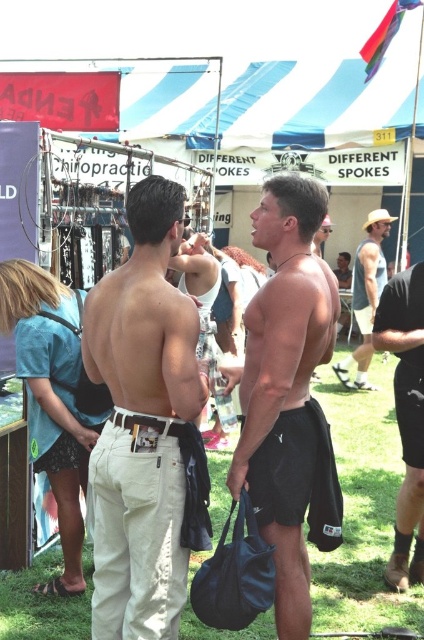
You are standing at the back of the scene and want to approach the two men. Which of the two men, the one wearing tan cotton pants at center or the one wearing black matte shorts at center, will you reach first?

The tan cotton pants at center is closer to the viewer than the black matte shorts at center, so you will reach the man wearing tan cotton pants at center first.

You are a fashion designer analyzing clothing items in the scene. Which clothing item, the tan cotton pants at center or the denim shorts at lower left, has a narrower width?

The tan cotton pants at center is thinner than the denim shorts at lower left, so the tan cotton pants at center has a narrower width.